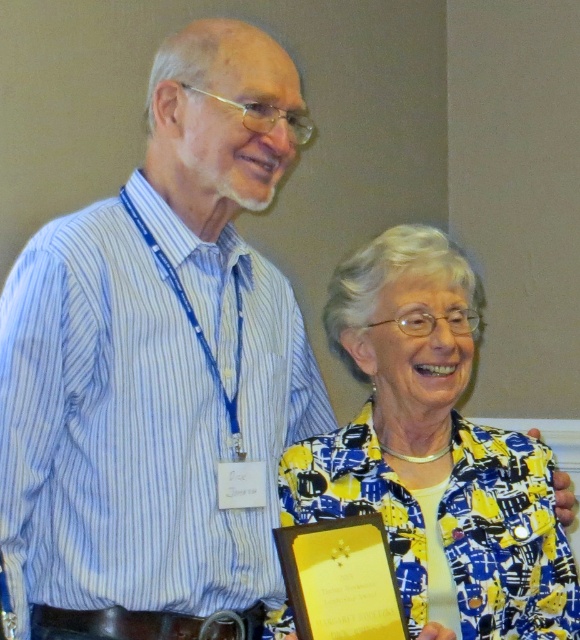
How far apart are blue striped shirt at center and gold/yellow paper at lower center?

29.24 centimeters

Measure the distance between blue striped shirt at center and gold/yellow paper at lower center.

A distance of 11.51 inches exists between blue striped shirt at center and gold/yellow paper at lower center.

The image size is (580, 640). I want to click on blue striped shirt at center, so click(160, 369).

Between blue striped shirt at center and yellow printed fabric at center, which one is positioned lower?

yellow printed fabric at center

Does blue striped shirt at center appear over yellow printed fabric at center?

Correct, blue striped shirt at center is located above yellow printed fabric at center.

Does point (288, 154) come farther from viewer compared to point (324, 465)?

No, (288, 154) is in front of (324, 465).

Identify the location of blue striped shirt at center. 160,369.

Is yellow printed fabric at center smaller than gold/yellow paper at lower center?

Incorrect, yellow printed fabric at center is not smaller in size than gold/yellow paper at lower center.

From the picture: Which is below, yellow printed fabric at center or gold/yellow paper at lower center?

gold/yellow paper at lower center

Is point (455, 488) less distant than point (304, 566)?

No, it is behind (304, 566).

Where is `yellow printed fabric at center`? yellow printed fabric at center is located at coordinates (435, 452).